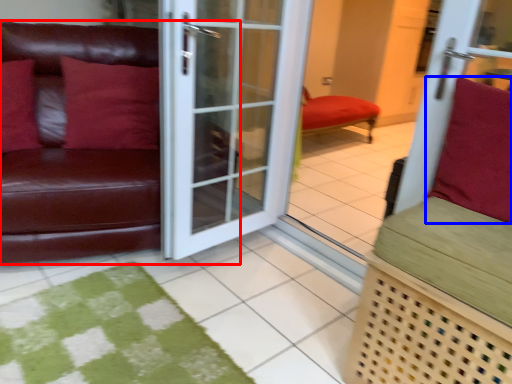
Question: Which of the following is the farthest to the observer, studio couch (highlighted by a red box) or pillow (highlighted by a blue box)?

Choices:
 (A) studio couch
 (B) pillow

Answer: (A)